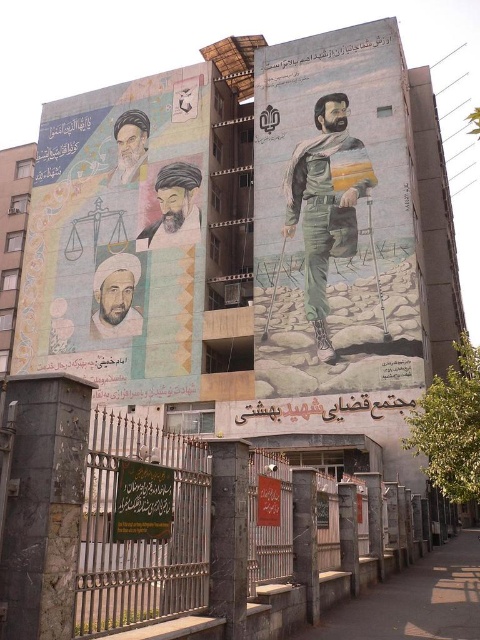
Which is more to the left, green camouflage pants at center or matte black portrait at upper left?

From the viewer's perspective, matte black portrait at upper left appears more on the left side.

At what (x,y) coordinates should I click in order to perform the action: click on green camouflage pants at center. Please return your answer as a coordinate pair (x, y). Looking at the image, I should click on click(324, 205).

From the picture: Does green camouflage pants at center have a larger size compared to matte white beard at center?

Indeed, green camouflage pants at center has a larger size compared to matte white beard at center.

Is point (315, 248) farther from camera compared to point (96, 282)?

No, (315, 248) is closer to viewer.

The width and height of the screenshot is (480, 640). I want to click on green camouflage pants at center, so click(324, 205).

Does matte paper poster at left appear on the right side of green camouflage pants at center?

Incorrect, matte paper poster at left is not on the right side of green camouflage pants at center.

Between point (48, 364) and point (322, 182), which one is positioned behind?

The point (48, 364) is behind.

Is point (134, 355) positioned before point (359, 192)?

That is False.

What are the coordinates of `matte paper poster at left` in the screenshot? It's located at (119, 237).